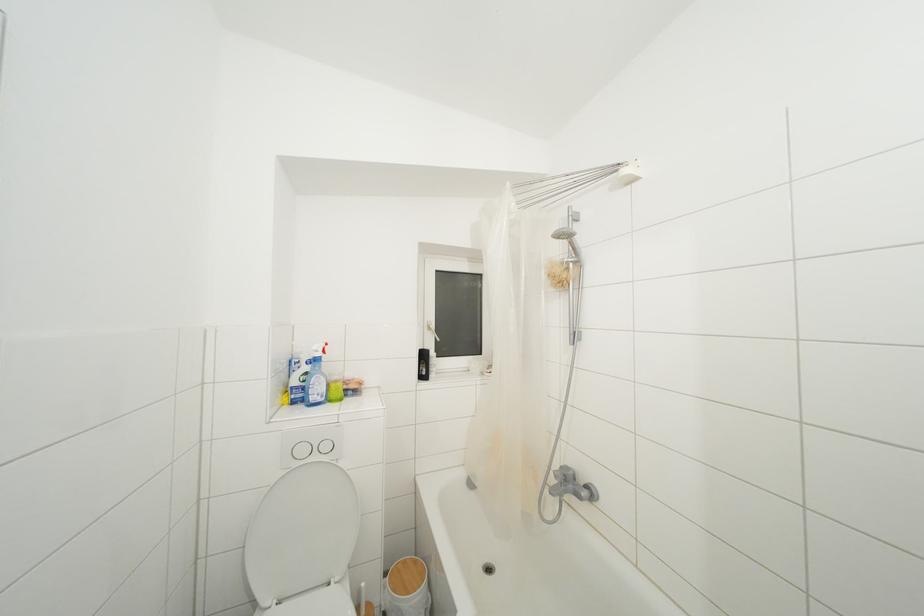
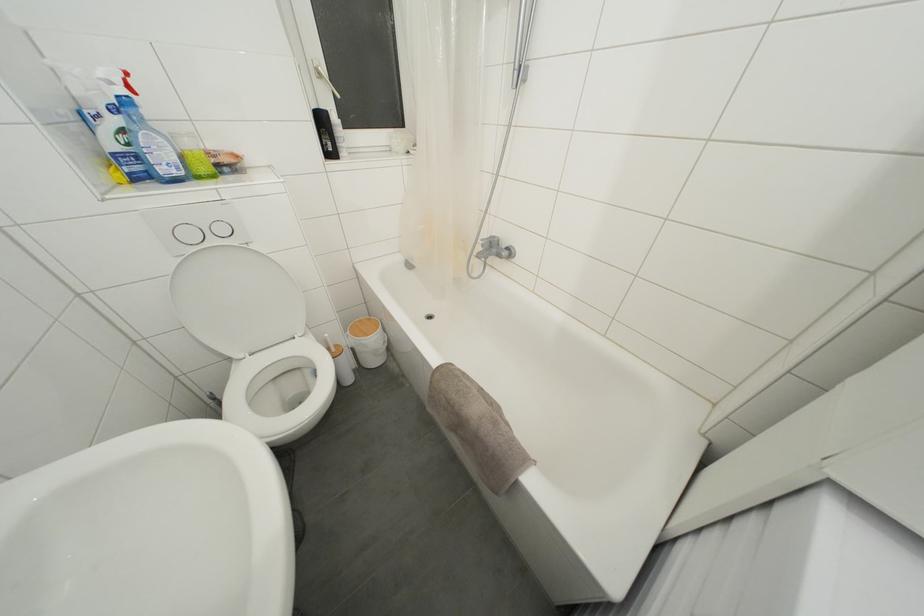
The point at (428,361) is marked in the first image. Where is the corresponding point in the second image?

(325, 126)